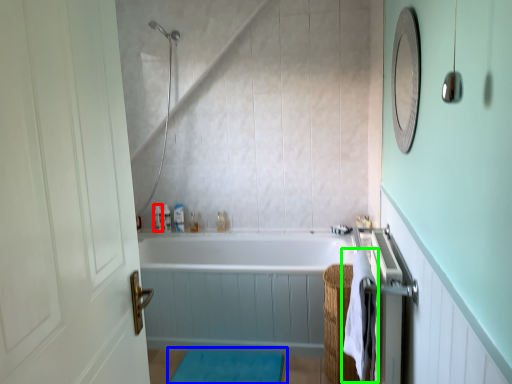
Question: Which object is the farthest from toiletry (highlighted by a red box)? Choose among these: bath mat (highlighted by a blue box) or beach towel (highlighted by a green box).

Choices:
 (A) bath mat
 (B) beach towel

Answer: (B)